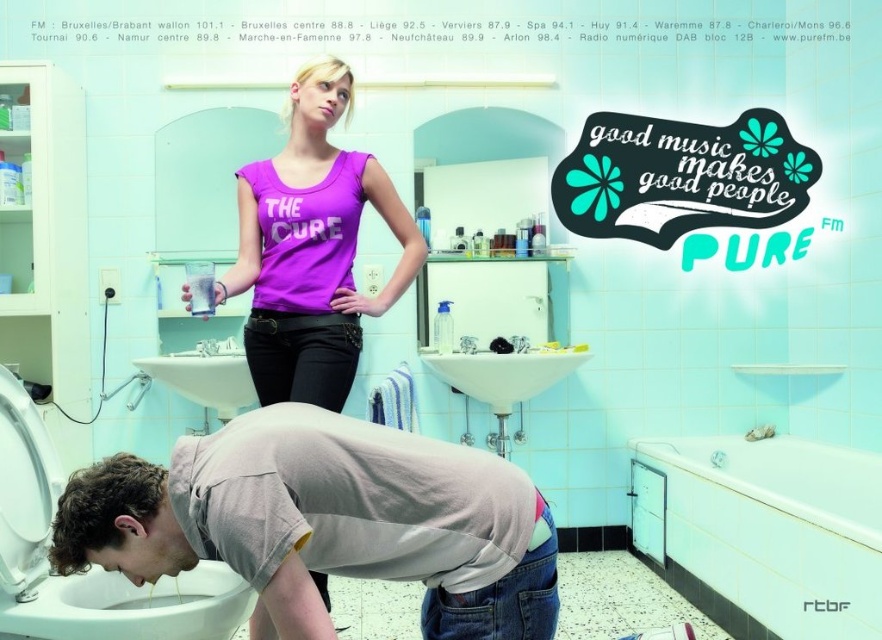
You are standing in the bathroom and need to reach the toilet located at point (192, 365). There is an obstruction at point (333, 376). Can you walk straight towards the toilet without going around the obstruction?

Point (333, 376) is in front of point (192, 365), so the obstruction is blocking the direct path to the toilet. You will need to go around it.

Based on the photo, you are a nurse in a hospital bathroom and need to locate the gray cotton shirt at lower center. According to the coordinates provided, where should you look?

The gray cotton shirt at lower center is located at point [324,520].